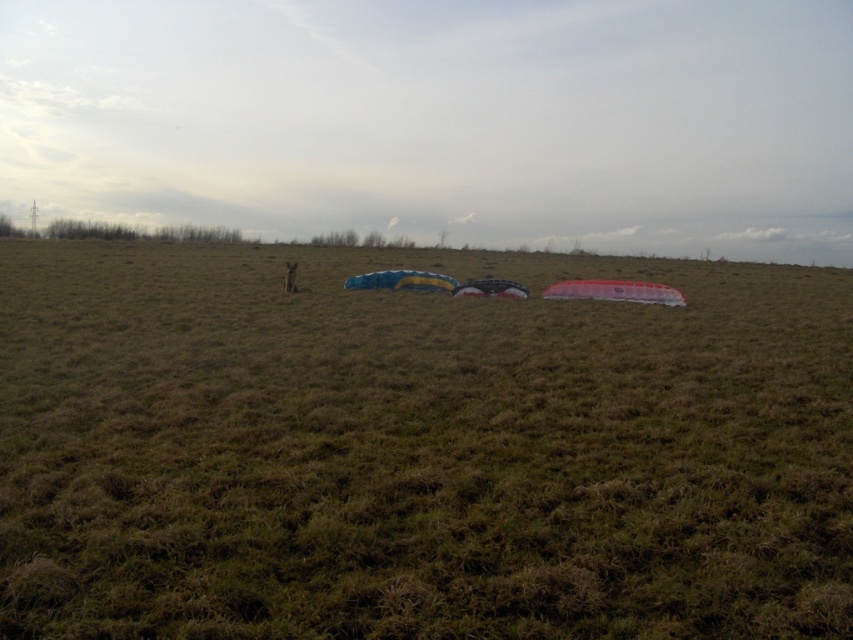
Question: Which point is closer to the camera?

Choices:
 (A) brown grassy field at center
 (B) blue glossy kite at center
 (C) translucent black kite at center
 (D) transparent plastic kite at center

Answer: (A)

Question: Which is farther from the blue glossy kite at center?

Choices:
 (A) brown grassy field at center
 (B) transparent plastic kite at center

Answer: (A)

Question: Which point appears farthest from the camera in this image?

Choices:
 (A) (596, 280)
 (B) (265, 592)
 (C) (393, 280)

Answer: (A)

Question: In this image, where is transparent plastic kite at center located relative to translucent black kite at center?

Choices:
 (A) below
 (B) above

Answer: (B)

Question: Is brown grassy field at center bigger than transparent plastic kite at center?

Choices:
 (A) no
 (B) yes

Answer: (B)

Question: Can you confirm if blue glossy kite at center is smaller than translucent black kite at center?

Choices:
 (A) no
 (B) yes

Answer: (A)